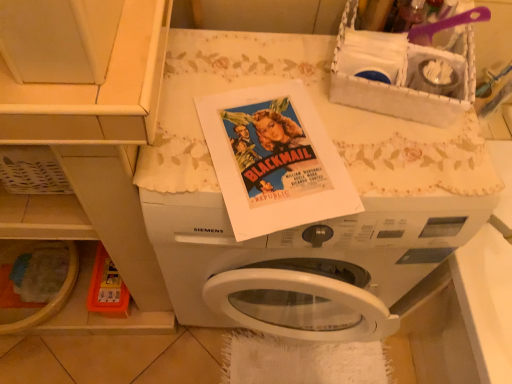
At what (x,y) coordinates should I click in order to perform the action: click on free space to the left of white woven basket at upper right. Please return your answer as a coordinate pair (x, y). Looking at the image, I should click on (265, 81).